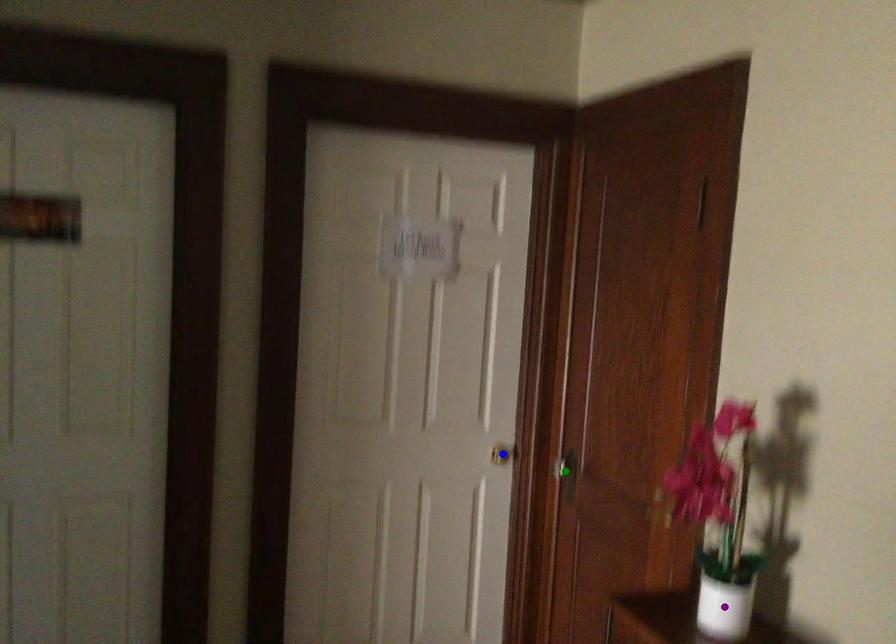
Order these from farthest to nearest:
purple point, blue point, green point

blue point, green point, purple point